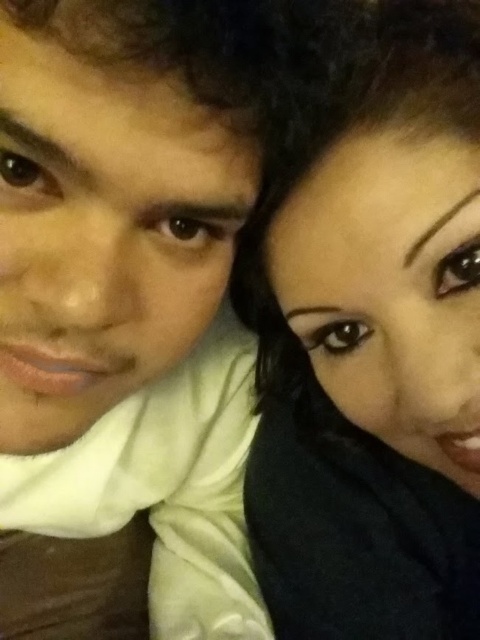
Question: Which point is farther from the camera taking this photo?

Choices:
 (A) (67, 294)
 (B) (419, 100)

Answer: (B)

Question: Is matte white scarf at upper left wider than black matte hair at upper right?

Choices:
 (A) yes
 (B) no

Answer: (A)

Question: Considering the relative positions of matte white scarf at upper left and black matte hair at upper right in the image provided, where is matte white scarf at upper left located with respect to black matte hair at upper right?

Choices:
 (A) above
 (B) below

Answer: (B)

Question: Which of the following is the closest to the observer?

Choices:
 (A) matte white scarf at upper left
 (B) black matte hair at upper right

Answer: (A)

Question: Is matte white scarf at upper left above black matte hair at upper right?

Choices:
 (A) yes
 (B) no

Answer: (B)